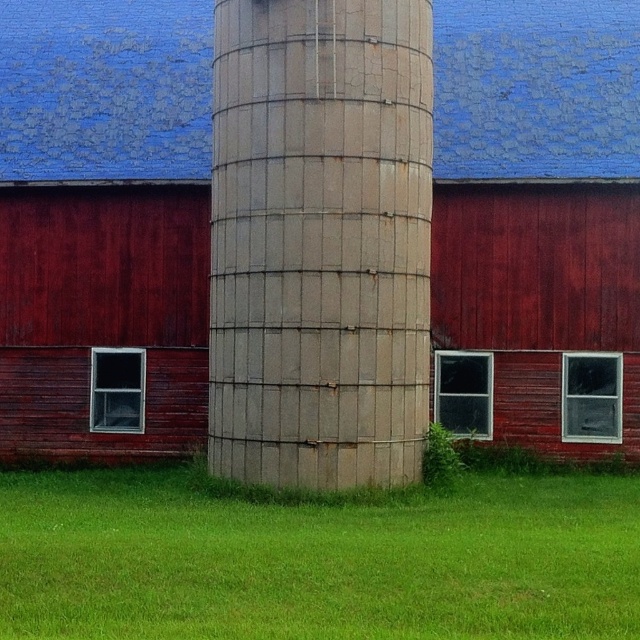
Which is below, rusty metal water tower at center or green grass at lower center?

Positioned lower is green grass at lower center.

Can you confirm if rusty metal water tower at center is shorter than green grass at lower center?

No.

I want to click on rusty metal water tower at center, so click(x=320, y=241).

Identify the location of rusty metal water tower at center. (320, 241).